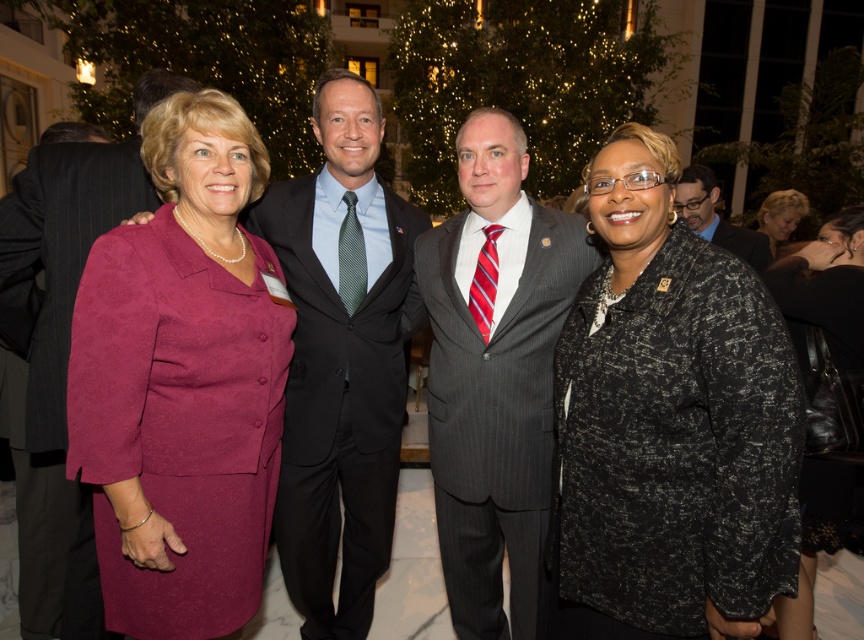
In the scene shown: You are a photographer trying to capture a closeup of the black textured blazer at right located at point (669, 422). Can you confirm if this point is within the frame of the camera which has a maximum field of view covering up to 0.8 in both x and y coordinates?

The black textured blazer at right is located at point (669, 422). Since both coordinates are below 0.8, the point is within the camera frame.